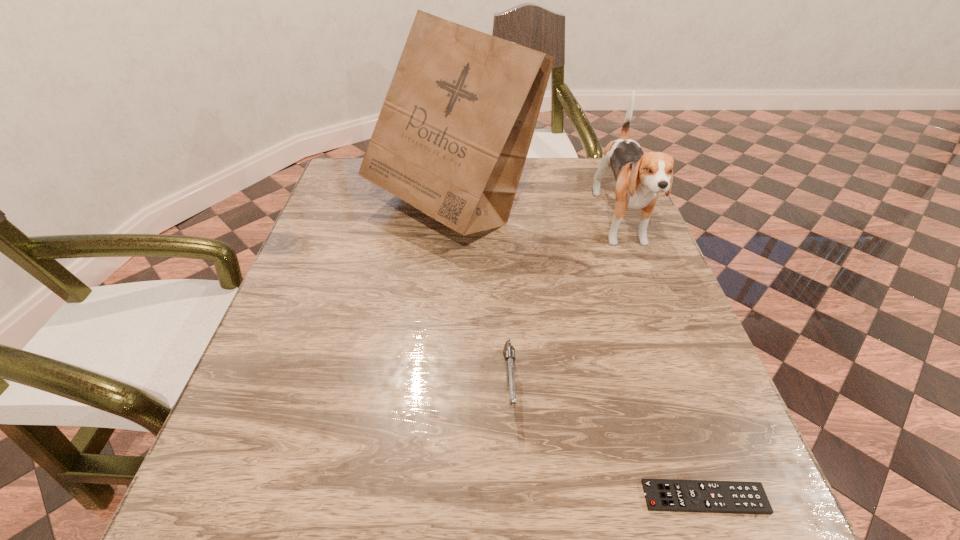
Where is `blank region between the third shortest object and the second nearest object`? The image size is (960, 540). blank region between the third shortest object and the second nearest object is located at coordinates (564, 303).

Identify the location of free spot between the shortest object and the second nearest object. (607, 440).

Locate an element on the screen. empty space that is in between the nearest object and the third shortest object is located at coordinates (662, 361).

You are a GUI agent. You are given a task and a screenshot of the screen. Output one action in this format:
    pyautogui.click(x=<x>, y=<y>)
    Task: Click on the free space between the third shortest object and the shortest object
    The width and height of the screenshot is (960, 540).
    Given the screenshot: What is the action you would take?
    pyautogui.click(x=662, y=361)

This screenshot has height=540, width=960. In order to click on vacant space that is in between the shortest object and the second shortest object in this screenshot , I will do [607, 440].

At what (x,y) coordinates should I click in order to perform the action: click on the closest object to the nearest object. Please return your answer as a coordinate pair (x, y). The image size is (960, 540). Looking at the image, I should click on (509, 351).

I want to click on object that is the third closest to the grocery bag, so click(x=736, y=497).

The width and height of the screenshot is (960, 540). Identify the location of free space that satisfies the following two spatial constraints: 1. on the front side of the shortest object; 2. on the left side of the grocery bag. (430, 497).

At what (x,y) coordinates should I click in order to perform the action: click on vacant space that satisfies the following two spatial constraints: 1. aiming along the barrel of the gun; 2. on the right side of the nearest object. Please return your answer as a coordinate pair (x, y). Looking at the image, I should click on (516, 497).